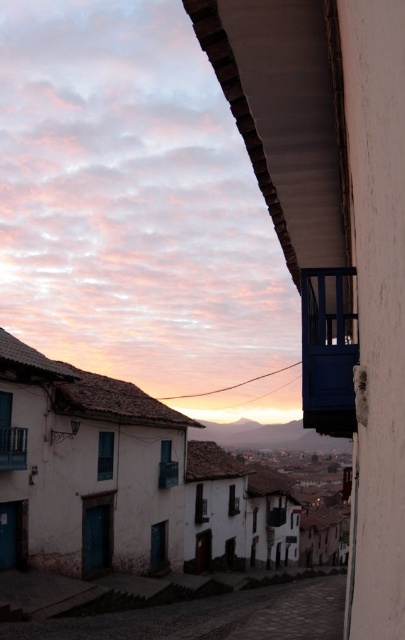
Which is above, white stucco buildings at center or cobblestone stairs at lower center?

white stucco buildings at center is above.

Is the position of white stucco buildings at center less distant than that of cobblestone stairs at lower center?

No, white stucco buildings at center is behind cobblestone stairs at lower center.

What do you see at coordinates (123, 481) in the screenshot?
I see `white stucco buildings at center` at bounding box center [123, 481].

Where is `white stucco buildings at center`? white stucco buildings at center is located at coordinates (123, 481).

The height and width of the screenshot is (640, 405). What do you see at coordinates (211, 616) in the screenshot? I see `cobblestone stairs at lower center` at bounding box center [211, 616].

Can you confirm if cobblestone stairs at lower center is smaller than matte blue balcony at center?

No.

Locate an element on the screen. cobblestone stairs at lower center is located at coordinates (211, 616).

Locate an element on the screen. Image resolution: width=405 pixels, height=640 pixels. cobblestone stairs at lower center is located at coordinates [x=211, y=616].

From the picture: Who is positioned more to the right, matte blue balcony at center or smooth wooden balcony at lower left?

matte blue balcony at center

Between matte blue balcony at center and smooth wooden balcony at lower left, which one has less height?

With less height is smooth wooden balcony at lower left.

Where is `matte blue balcony at center`? The width and height of the screenshot is (405, 640). matte blue balcony at center is located at coordinates (328, 349).

I want to click on matte blue balcony at center, so click(x=328, y=349).